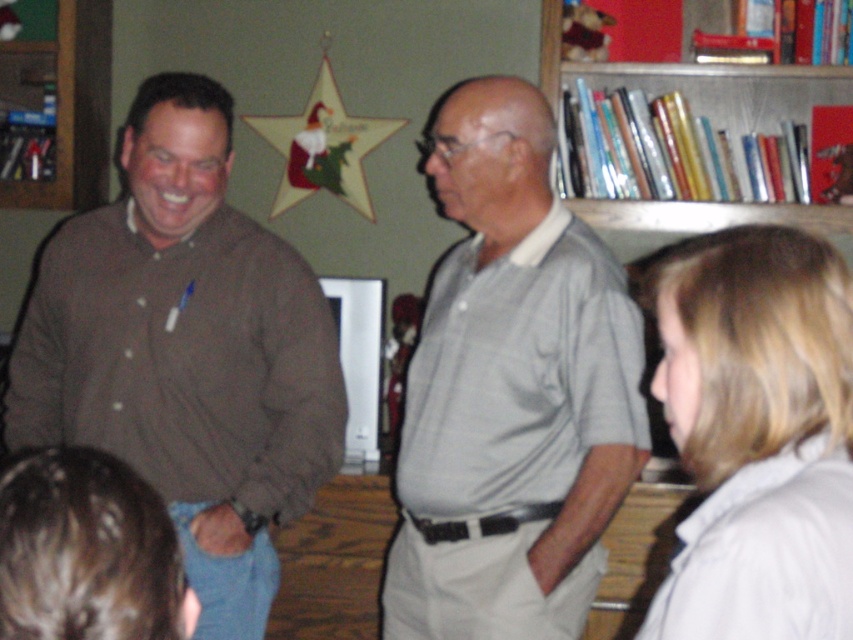
Question: Which point is farther to the camera?

Choices:
 (A) (555, 401)
 (B) (685, 442)
 (C) (781, 221)
 (D) (200, 273)

Answer: (C)

Question: Which object is the closest to the blonde hair at lower right?

Choices:
 (A) metallic silver books at upper right
 (B) gray cotton shirt at center

Answer: (B)

Question: Which object is positioned closest to the metallic silver books at upper right?

Choices:
 (A) gray cotton shirt at center
 (B) blonde hair at lower right
 (C) brown cotton shirt at left

Answer: (A)

Question: Observing the image, what is the correct spatial positioning of brown cotton shirt at left in reference to gray cotton shirt at center?

Choices:
 (A) left
 (B) right

Answer: (A)

Question: Is blonde hair at lower right in front of metallic silver books at upper right?

Choices:
 (A) no
 (B) yes

Answer: (B)

Question: Can you confirm if gray cotton shirt at center is positioned to the right of metallic silver books at upper right?

Choices:
 (A) no
 (B) yes

Answer: (A)